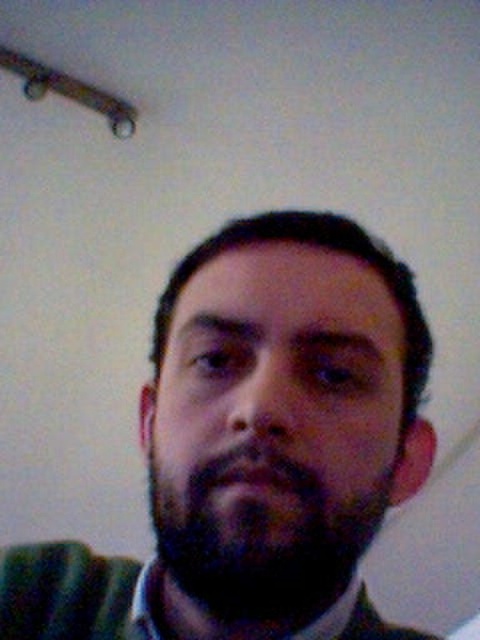
Question: Does dark brown hair at center appear on the left side of dark brown fuzzy beard at center?

Choices:
 (A) yes
 (B) no

Answer: (A)

Question: Which of the following is the farthest from the observer?

Choices:
 (A) dark brown fuzzy beard at center
 (B) dark brown hair at center

Answer: (A)

Question: Can you confirm if dark brown hair at center is thinner than dark brown fuzzy beard at center?

Choices:
 (A) yes
 (B) no

Answer: (B)

Question: In this image, where is dark brown hair at center located relative to dark brown fuzzy beard at center?

Choices:
 (A) below
 (B) above

Answer: (A)